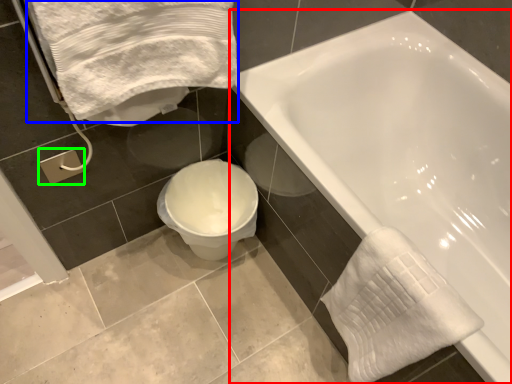
Question: Based on their relative distances, which object is farther from bathtub (highlighted by a red box)? Choose from bath towel (highlighted by a blue box) and towel bar (highlighted by a green box).

Choices:
 (A) bath towel
 (B) towel bar

Answer: (B)